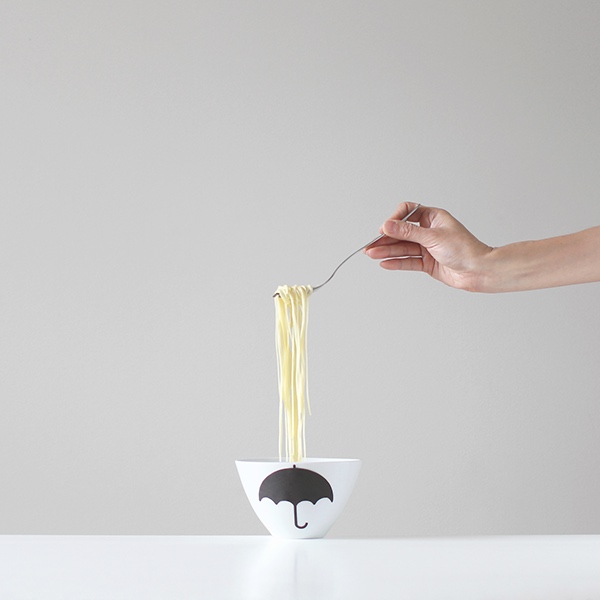
Identify the location of silver fork handle. 357,249.